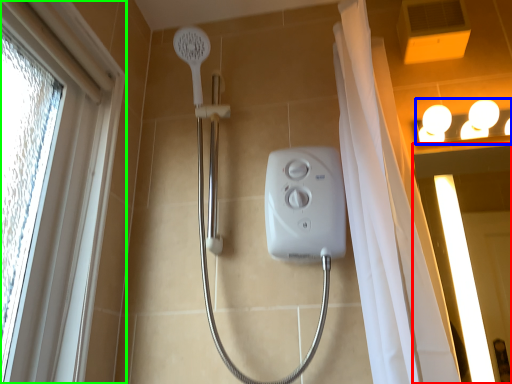
Question: Which is nearer to the screen door (highlighted by a red box)? light fixture (highlighted by a blue box) or window (highlighted by a green box).

Choices:
 (A) light fixture
 (B) window

Answer: (A)